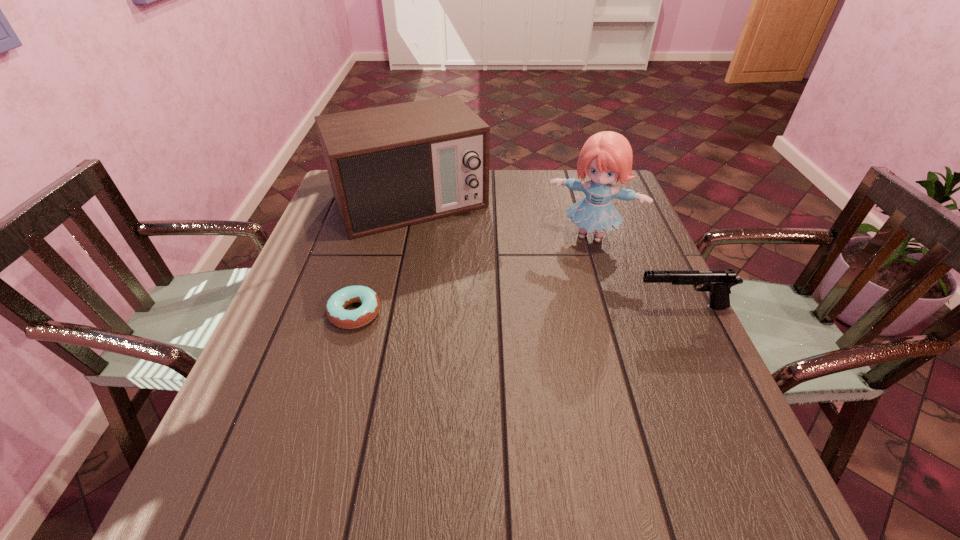
At what (x,y) coordinates should I click in order to perform the action: click on empty location between the gun and the radio receiver. Please return your answer as a coordinate pair (x, y). This screenshot has width=960, height=540. Looking at the image, I should click on [x=546, y=254].

Where is `vacant region between the doughnut and the radio receiver`? The image size is (960, 540). vacant region between the doughnut and the radio receiver is located at coordinates (382, 257).

Locate an element on the screen. vacant space in between the radio receiver and the gun is located at coordinates (546, 254).

Image resolution: width=960 pixels, height=540 pixels. Find the location of `free space between the gun and the radio receiver`. free space between the gun and the radio receiver is located at coordinates (546, 254).

Locate which object is the second closest to the gun. Please provide its 2D coordinates. Your answer should be formatted as a tuple, i.e. [(x, y)], where the tuple contains the x and y coordinates of a point satisfying the conditions above.

[(392, 166)]

Find the location of `the third closest object to the second tallest object`. the third closest object to the second tallest object is located at coordinates (717, 282).

This screenshot has height=540, width=960. I want to click on free space that satisfies the following two spatial constraints: 1. on the front side of the tallest object; 2. on the right side of the radio receiver, so tap(402, 236).

In order to click on vacant space that satisfies the following two spatial constraints: 1. on the back side of the shortest object; 2. on the left side of the tallest object in this screenshot , I will do `click(377, 236)`.

The height and width of the screenshot is (540, 960). I want to click on free space that satisfies the following two spatial constraints: 1. on the front side of the third tallest object; 2. at the aiming end of the doll, so (x=612, y=307).

Locate an element on the screen. free space that satisfies the following two spatial constraints: 1. on the back side of the doughnut; 2. on the right side of the tallest object is located at coordinates (377, 236).